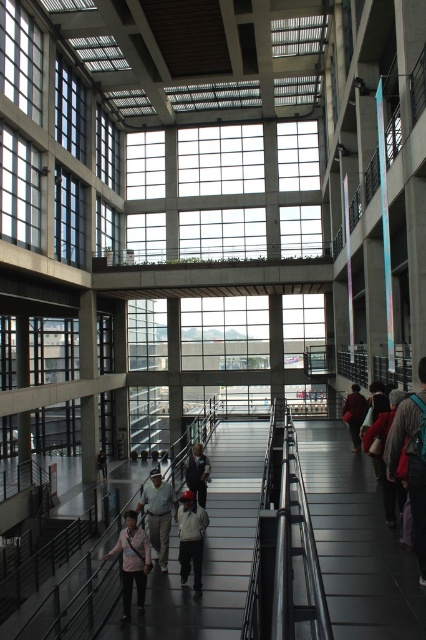
From the picture: You are a delivery robot with a package that is 2 meters long. You are in the atrium and need to move from the metallic gray escalator at center to the light brown leather jacket at center. Can your package fit through the space between them?

The distance between the metallic gray escalator at center and the light brown leather jacket at center is 1.99 meters. Since the package is 2 meters long, it is slightly too long to fit through the space between them. You may need to find an alternative route or adjust the package size.

You are a delivery person carrying a large package that is 1.2 meters wide. You are in the atrium and see the metallic gray escalator at center and the light brown leather jacket at center. Can your package fit through the space between these two objects?

The metallic gray escalator at center is wider than the light brown leather jacket at center. Since the package is 1.2 meters wide, it depends on the actual width of the space between them. However, without specific measurements, it is uncertain if the package will fit.

You are a delivery person carrying a large package and need to reach the second floor. You see the metallic gray escalator at center and the light brown leather jacket at center. Which object should you approach to access the upper level?

You should approach the metallic gray escalator at center to reach the upper level since it is an escalator designed for moving between floors, whereas the light brown leather jacket at center is an item of clothing and cannot be used for ascending.